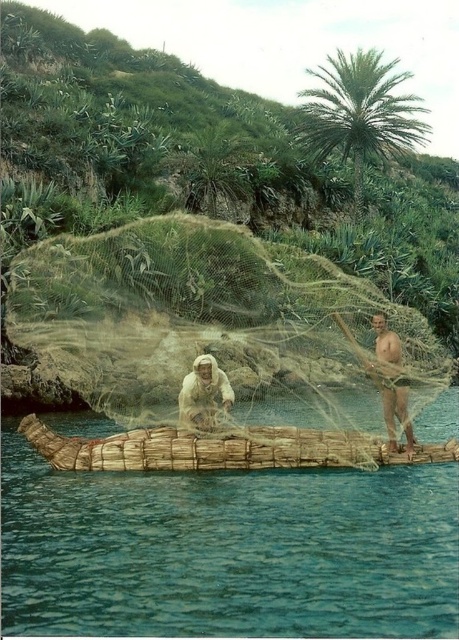
You are planning to place a small cooler on the brown wooden raft at center. However, you notice there is already a brown woven basket at center on it. Based on the description, will the cooler fit on the raft without displacing the basket?

The brown wooden raft at center is shorter than the brown woven basket at center. Since the raft is shorter, it might not have enough space to accommodate both the existing basket and the cooler. Therefore, the cooler may not fit without displacing the basket.

You are a tourist standing on the shore observing the brown wooden raft at center and the green mesh fishing net at center. Which object appears larger in the scene?

The green mesh fishing net at center appears larger than the brown wooden raft at center because the brown wooden raft at center has a smaller size compared to green mesh fishing net at center.